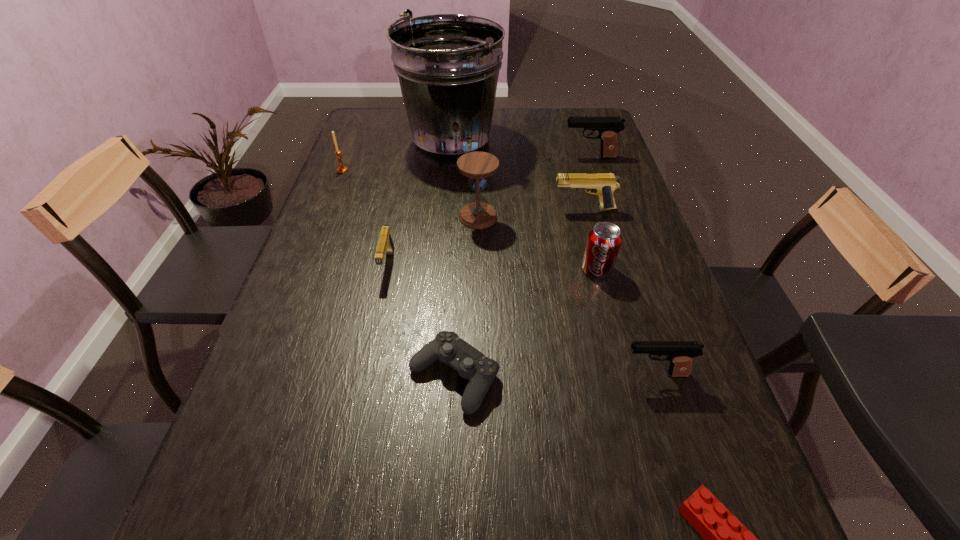
At what (x,y) coordinates should I click in order to perform the action: click on blank space located at the barrel of the second farthest pistol. Please return your answer as a coordinate pair (x, y). The image size is (960, 540). Looking at the image, I should click on (423, 208).

You are a GUI agent. You are given a task and a screenshot of the screen. Output one action in this format:
    pyautogui.click(x=<x>, y=<y>)
    Task: Click on the vacant space positioned at the barrel of the second farthest pistol
    This screenshot has height=540, width=960.
    Given the screenshot: What is the action you would take?
    click(507, 208)

Where is `free space located 0.090m at the barrel of the second farthest pistol`? This screenshot has width=960, height=540. free space located 0.090m at the barrel of the second farthest pistol is located at coordinates (521, 208).

The height and width of the screenshot is (540, 960). Find the location of `free region located 0.100m at the barrel of the nearer black pistol`. free region located 0.100m at the barrel of the nearer black pistol is located at coordinates (571, 374).

Where is `vacant position located 0.110m at the barrel of the nearer black pistol`? Image resolution: width=960 pixels, height=540 pixels. vacant position located 0.110m at the barrel of the nearer black pistol is located at coordinates (566, 374).

You are a GUI agent. You are given a task and a screenshot of the screen. Output one action in this format:
    pyautogui.click(x=<x>, y=<y>)
    Task: Click on the free space located at the barrel of the nearer black pistol
    This screenshot has width=960, height=540.
    Given the screenshot: What is the action you would take?
    pyautogui.click(x=512, y=374)

This screenshot has width=960, height=540. In order to click on vacant area located 0.140m at the barrel of the second nearest pistol in this screenshot , I will do `click(373, 330)`.

Locate an element on the screen. This screenshot has height=540, width=960. free space located on the right of the control is located at coordinates (554, 376).

I want to click on object that is at the far edge, so click(x=447, y=65).

Locate an element on the screen. object that is at the left edge is located at coordinates [342, 169].